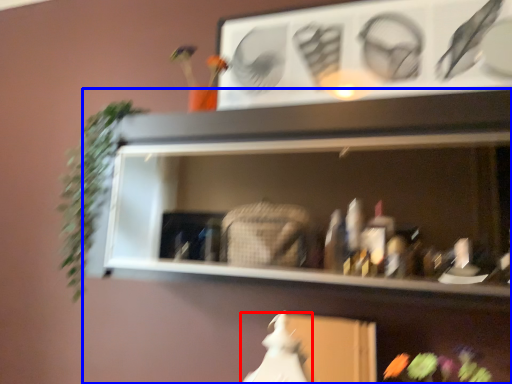
Question: Which object appears closest to the camera in this image, fancy dress (highlighted by a red box) or shelf (highlighted by a blue box)?

Choices:
 (A) fancy dress
 (B) shelf

Answer: (B)